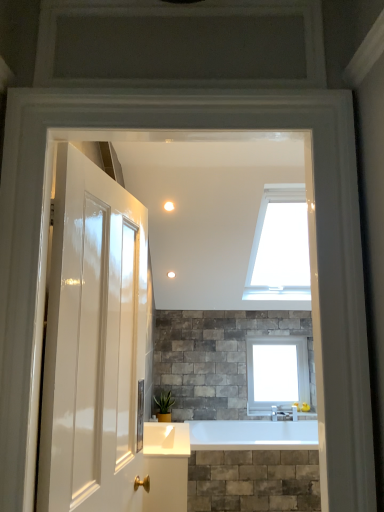
Question: Does green glossy plant at center come in front of white glass window at center?

Choices:
 (A) no
 (B) yes

Answer: (B)

Question: From the image's perspective, is green glossy plant at center under white glass window at center?

Choices:
 (A) no
 (B) yes

Answer: (B)

Question: Are green glossy plant at center and white glass window at center located far from each other?

Choices:
 (A) yes
 (B) no

Answer: (A)

Question: Can you confirm if green glossy plant at center is bigger than white glass window at center?

Choices:
 (A) no
 (B) yes

Answer: (A)

Question: Is white glass window at center inside green glossy plant at center?

Choices:
 (A) no
 (B) yes

Answer: (A)

Question: From the image's perspective, is green glossy plant at center on top of white glass window at center?

Choices:
 (A) yes
 (B) no

Answer: (B)

Question: From the image's perspective, is white glass window at center on top of green glossy plant at center?

Choices:
 (A) yes
 (B) no

Answer: (A)

Question: Is the position of white glass window at center more distant than that of green glossy plant at center?

Choices:
 (A) no
 (B) yes

Answer: (B)

Question: Could you tell me if white glass window at center is turned towards green glossy plant at center?

Choices:
 (A) no
 (B) yes

Answer: (A)

Question: Does white glass window at center appear on the left side of green glossy plant at center?

Choices:
 (A) no
 (B) yes

Answer: (A)

Question: Can you confirm if white glass window at center is smaller than green glossy plant at center?

Choices:
 (A) yes
 (B) no

Answer: (B)

Question: Is green glossy plant at center a part of white glass window at center?

Choices:
 (A) yes
 (B) no

Answer: (B)

Question: Which is correct: white glass window at center is inside green glossy plant at center, or outside of it?

Choices:
 (A) inside
 (B) outside

Answer: (B)